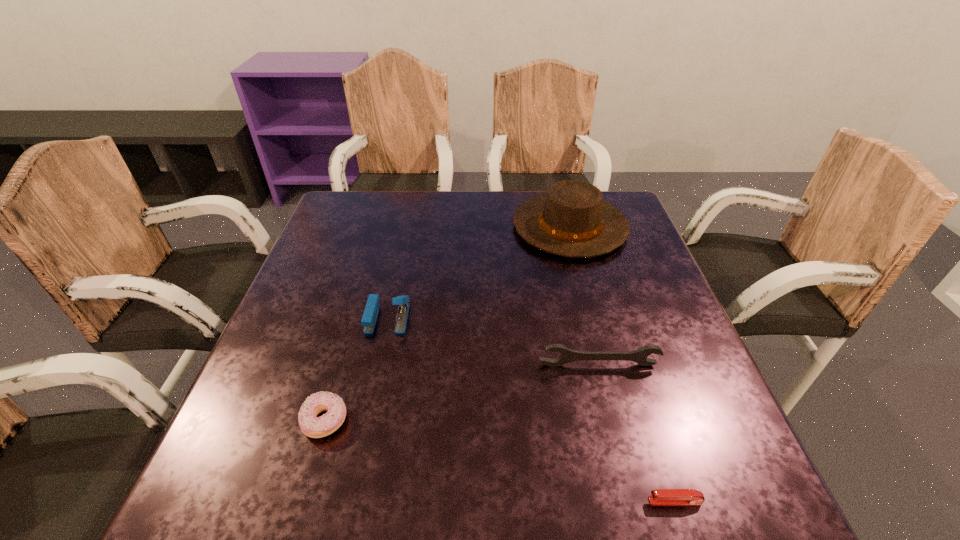
This screenshot has width=960, height=540. What are the coordinates of `free space located 0.210m on the front of the cowboy hat` in the screenshot? It's located at (595, 322).

Locate an element on the screen. This screenshot has width=960, height=540. free space located 0.240m on the right of the left stapler is located at coordinates (515, 318).

Identify the location of free space located 0.250m on the open ends of the third shortest object. The image size is (960, 540). (632, 495).

At what (x,y) coordinates should I click in order to perform the action: click on free point located on the front of the second nearest object. Please return your answer as a coordinate pair (x, y). The height and width of the screenshot is (540, 960). Looking at the image, I should click on (311, 471).

Identify the location of vacant space located 0.130m on the front-facing side of the right stapler. (566, 501).

Where is `vacant space located 0.320m on the front-facing side of the right stapler`? The width and height of the screenshot is (960, 540). vacant space located 0.320m on the front-facing side of the right stapler is located at coordinates (444, 501).

The width and height of the screenshot is (960, 540). In order to click on vacant space located on the front-facing side of the right stapler in this screenshot , I will do `click(470, 501)`.

Where is `object present at the far edge`? object present at the far edge is located at coordinates (572, 220).

The image size is (960, 540). Identify the location of object that is at the near edge. (659, 496).

This screenshot has width=960, height=540. What are the coordinates of `object that is at the left edge` in the screenshot? It's located at (312, 426).